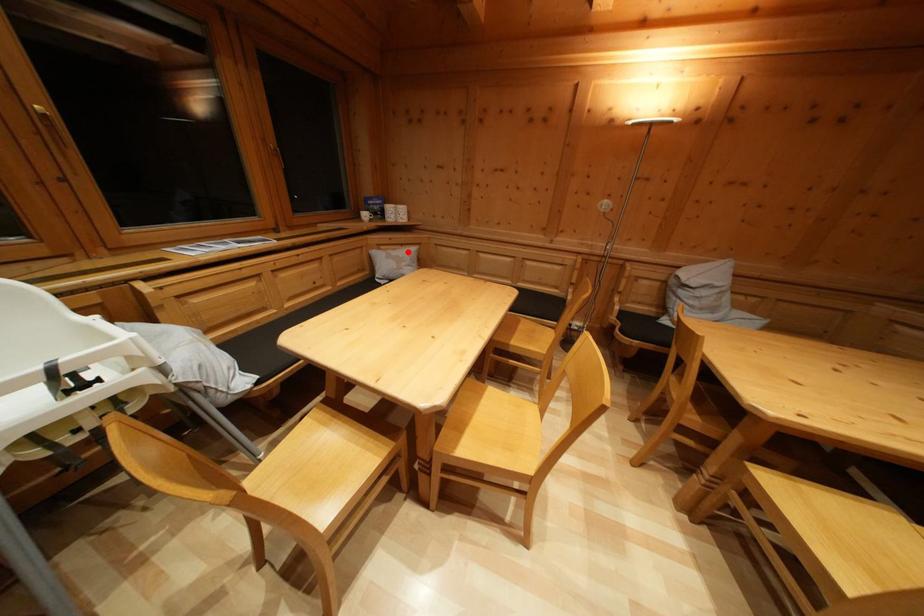
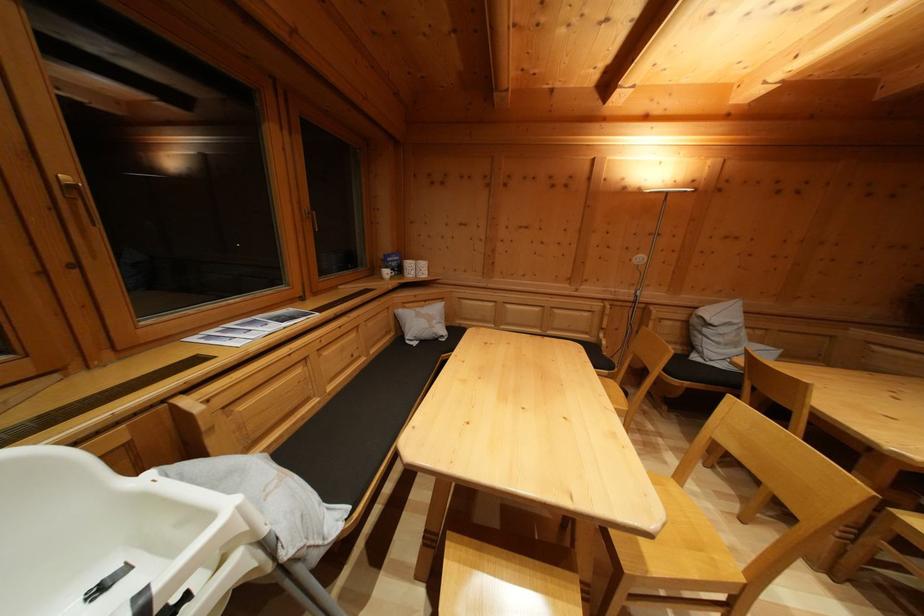
Question: I am providing you with two images of the same scene from different viewpoints. A red point is shown in image1. For the corresponding object point in image2, is it positioned nearer or farther from the camera?

Choices:
 (A) Nearer
 (B) Farther

Answer: (B)